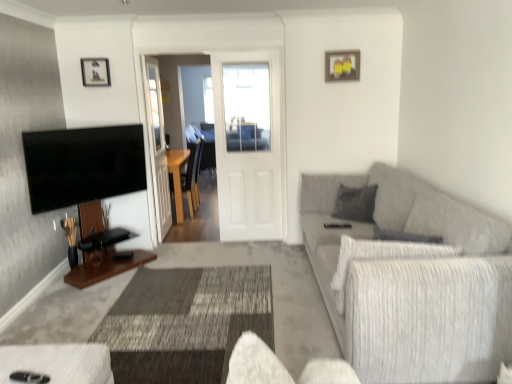
Question: Is the position of wooden picture frame at upper center, the 1th picture frame from the left, more distant than that of white matte door at center?

Choices:
 (A) no
 (B) yes

Answer: (A)

Question: Does wooden picture frame at upper center, the 1th picture frame from the left, appear on the right side of white matte door at center?

Choices:
 (A) yes
 (B) no

Answer: (B)

Question: Is wooden picture frame at upper center, the 1th picture frame from the left, not near white matte door at center?

Choices:
 (A) yes
 (B) no

Answer: (A)

Question: From the image's perspective, does wooden picture frame at upper center, the 1th picture frame from the left, appear higher than white matte door at center?

Choices:
 (A) no
 (B) yes

Answer: (B)

Question: Is white matte door at center completely or partially inside wooden picture frame at upper center, the 2th picture frame when ordered from right to left?

Choices:
 (A) yes
 (B) no

Answer: (B)

Question: Is wooden picture frame at upper center, the 2th picture frame when ordered from right to left, placed right next to white matte door at center?

Choices:
 (A) yes
 (B) no

Answer: (B)

Question: Does transparent glass door at center have a lesser width compared to textured gray couch at right?

Choices:
 (A) yes
 (B) no

Answer: (A)

Question: Considering the relative sizes of transparent glass door at center and textured gray couch at right in the image provided, is transparent glass door at center taller than textured gray couch at right?

Choices:
 (A) yes
 (B) no

Answer: (A)

Question: Is transparent glass door at center behind textured gray couch at right?

Choices:
 (A) yes
 (B) no

Answer: (A)

Question: From the image's perspective, is transparent glass door at center beneath textured gray couch at right?

Choices:
 (A) no
 (B) yes

Answer: (A)

Question: Is transparent glass door at center outside of textured gray couch at right?

Choices:
 (A) no
 (B) yes

Answer: (B)

Question: Does transparent glass door at center come in front of textured gray couch at right?

Choices:
 (A) yes
 (B) no

Answer: (B)

Question: Does white matte door at center have a smaller size compared to wooden picture frame at upper center, the 2th picture frame viewed from the left?

Choices:
 (A) no
 (B) yes

Answer: (A)